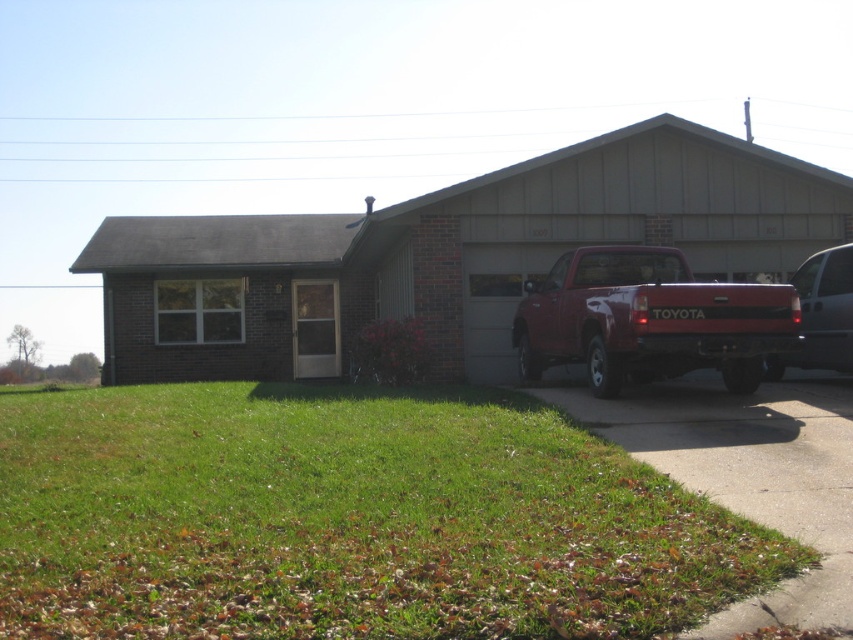
You are a delivery driver who needs to park your vehicle in the driveway. There is a matte red truck at right and a metallic silver van at right already parked. Which vehicle is closer to the left side of the driveway?

The matte red truck at right is positioned on the left side of the metallic silver van at right, so the matte red truck at right is closer to the left side of the driveway.